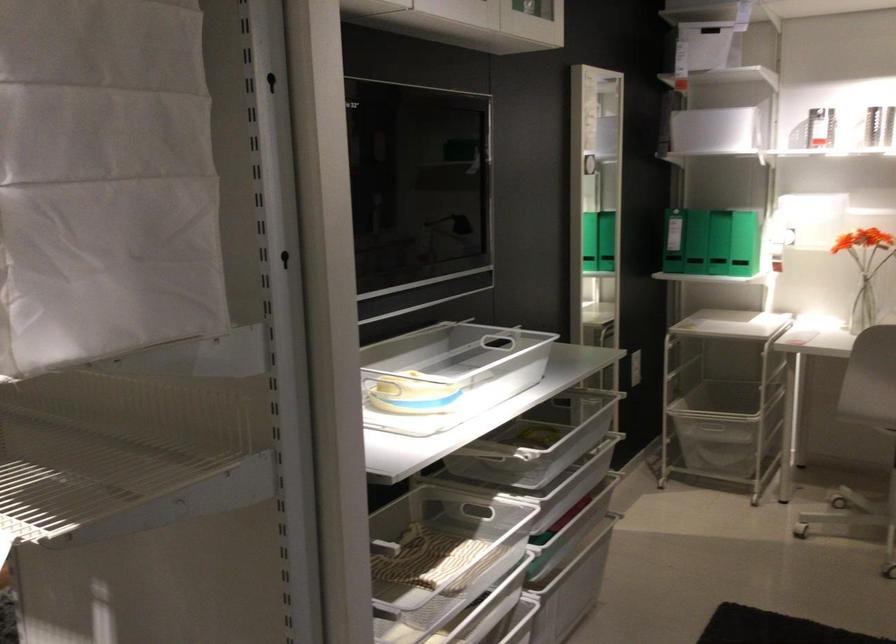
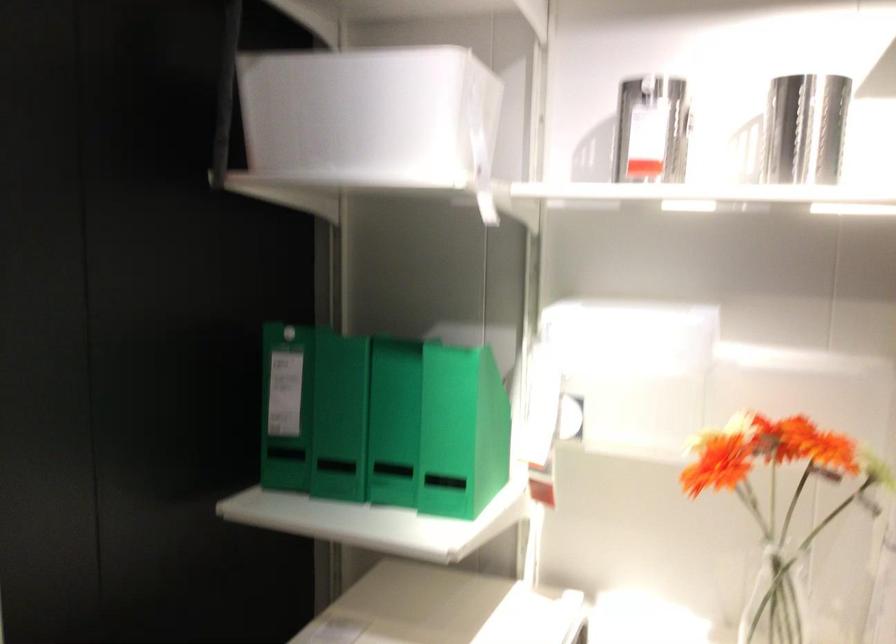
Find the pixel in the second image that matches point (718, 228) in the first image.

(339, 417)